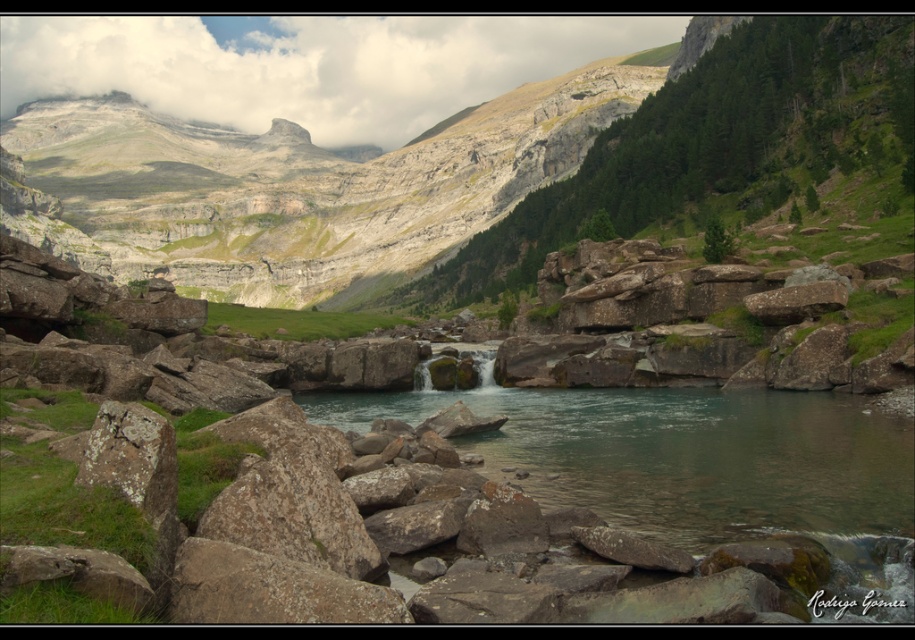
Question: Which point is closer to the camera?

Choices:
 (A) (718, 428)
 (B) (619, 58)

Answer: (A)

Question: Considering the relative positions of rugged stone mountain at center and clear water at center in the image provided, where is rugged stone mountain at center located with respect to clear water at center?

Choices:
 (A) above
 (B) below

Answer: (A)

Question: Can you confirm if rugged stone mountain at center is positioned to the right of clear water at center?

Choices:
 (A) yes
 (B) no

Answer: (B)

Question: Does rugged stone mountain at center lie in front of clear water at center?

Choices:
 (A) no
 (B) yes

Answer: (A)